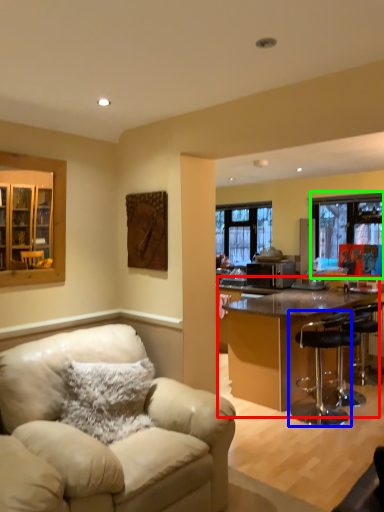
Question: Based on their relative distances, which object is farther from kitchen & dining room table (highlighted by a red box)? Choose from chair (highlighted by a blue box) and window (highlighted by a green box).

Choices:
 (A) chair
 (B) window

Answer: (B)